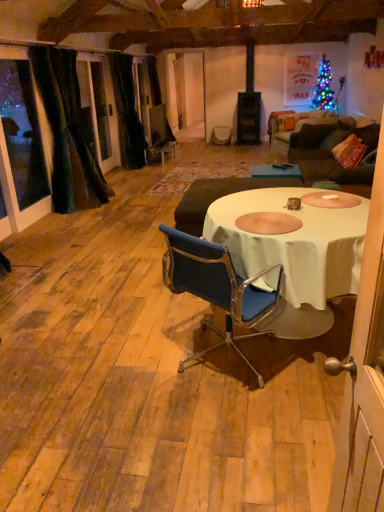
Where is `blank space to the left of blue fabric chair at center`? The image size is (384, 512). blank space to the left of blue fabric chair at center is located at coordinates (124, 367).